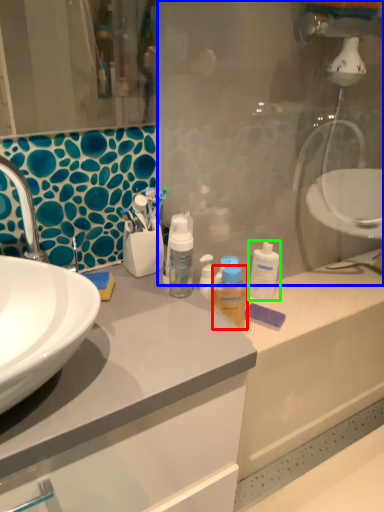
Question: Which object is positioned farthest from mouthwash (highlighted by a red box)? Select from glass door (highlighted by a blue box) and cleaning product (highlighted by a green box).

Choices:
 (A) glass door
 (B) cleaning product

Answer: (A)